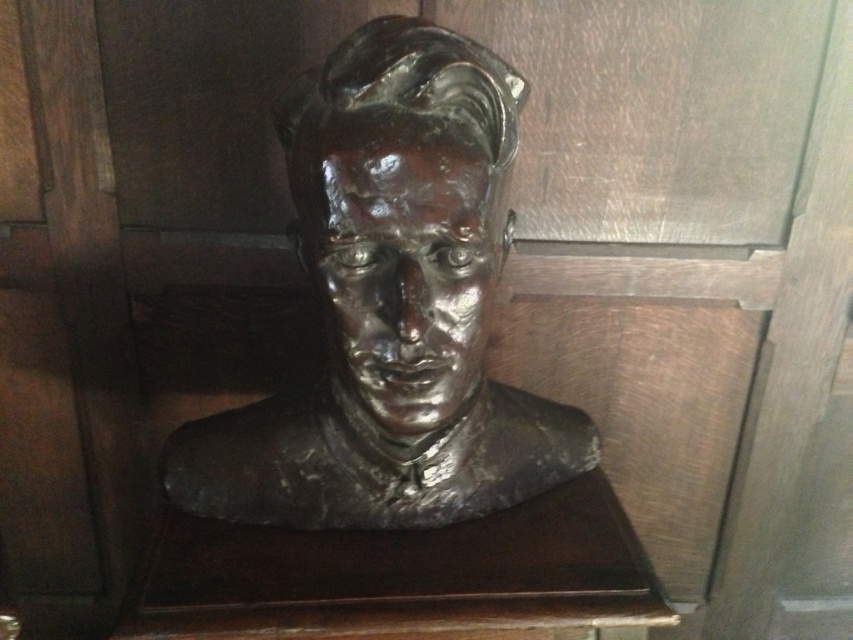
You are an art conservator standing 5 feet away from the shiny bronze bust at center. You need to clean it with a cloth that can reach up to 28 inches. Can you clean it without moving closer?

The shiny bronze bust at center is 26.31 inches from the camera, so yes, the cloth can reach it since 26.31 inches is within the 28 inches maximum reach.

You are an art conservator examining the bronze bust. Based on its coordinates, is the shiny bronze bust at center positioned closer to the top or bottom of the image?

The shiny bronze bust at center is located at point 0.461 on the vertical axis, which places it closer to the bottom of the image since the value is less than 0.5.